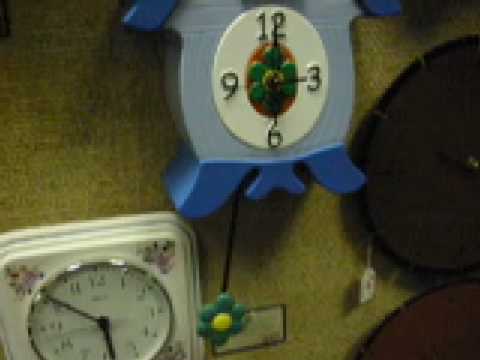
Find the location of a particular element. This screenshot has height=360, width=480. dark clock face is located at coordinates (425, 191), (434, 322).